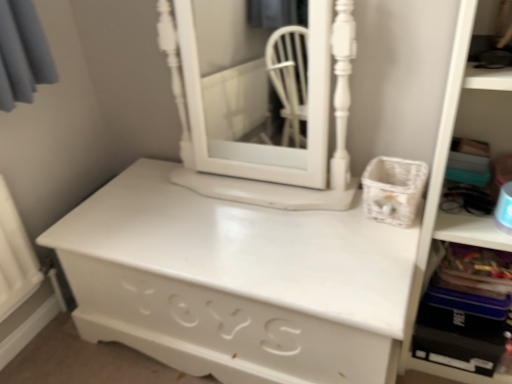
Identify the location of free location to the left of white painted wood medicine cabinet at center. (150, 202).